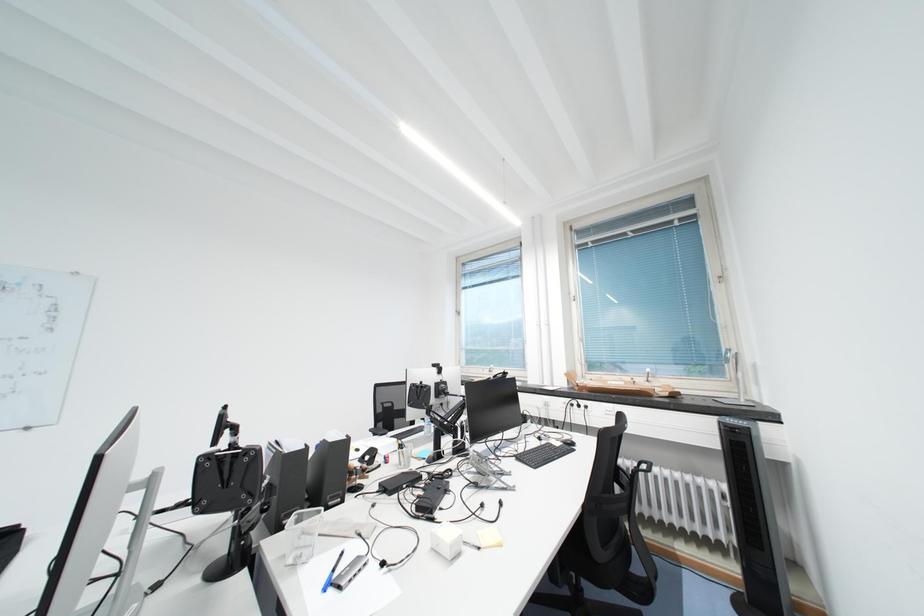
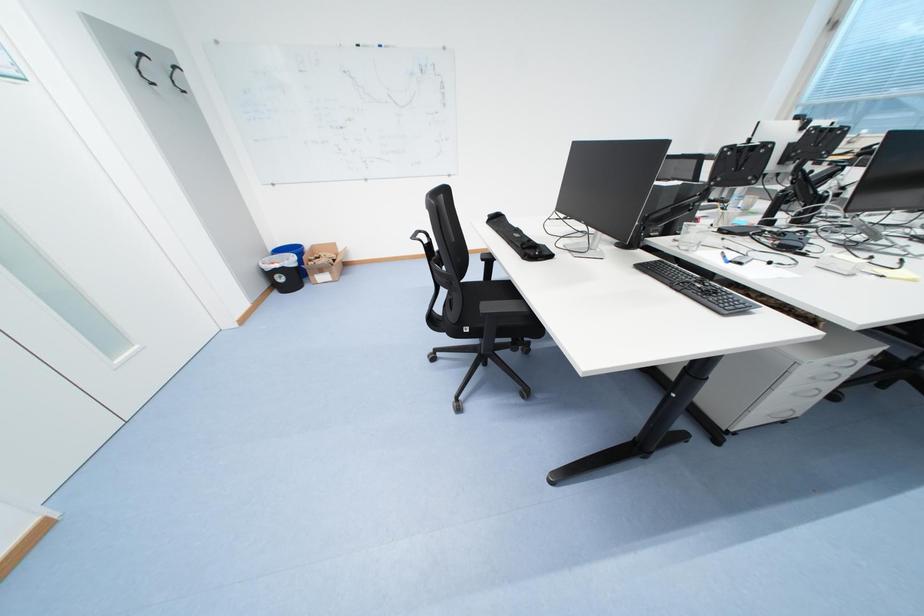
The first image is from the beginning of the video and the second image is from the end. How did the camera likely rotate when shooting the video?

The camera rotated toward left-down.